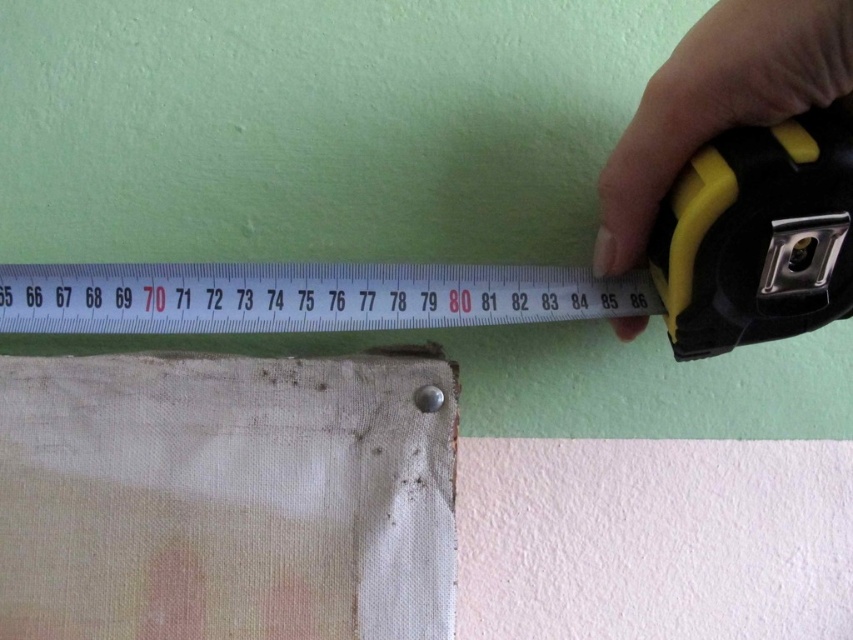
You need to determine if the white fabric pocket at lower left can fit into a space that is the same size as the white plastic ruler at upper center. Based on their sizes, can it fit?

The white fabric pocket at lower left has a width less than the white plastic ruler at upper center, so it can fit into a space the same size as the white plastic ruler at upper center.